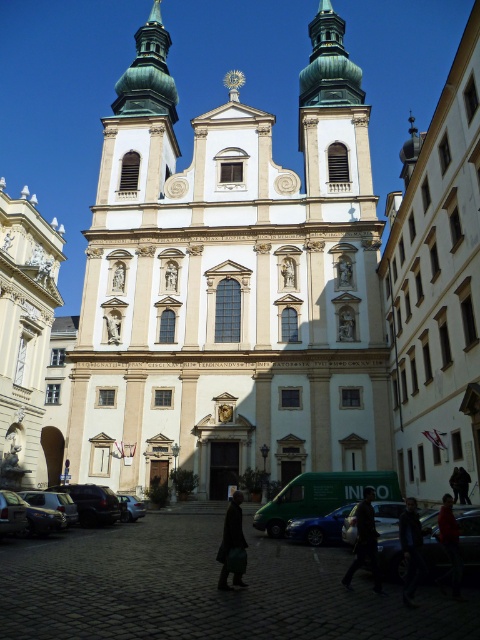
You are standing in front of the grand Baroque church and notice a dark gray jacket at center and a shiny silver car at center. Which object is nearer to you?

The dark gray jacket at center is closer to the viewer than the shiny silver car at center.